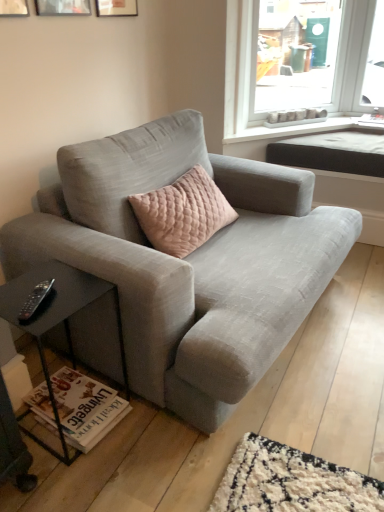
Where is `free space to the right of black matte side table at lower left`? This screenshot has height=512, width=384. free space to the right of black matte side table at lower left is located at coordinates (144, 436).